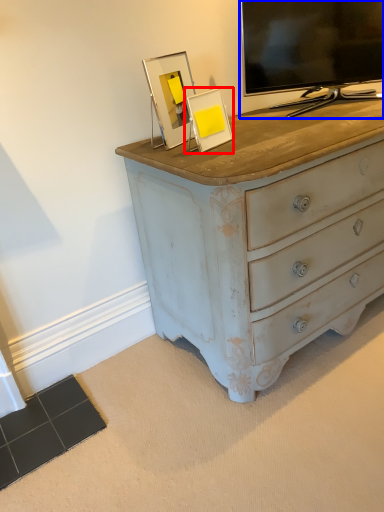
Question: Among these objects, which one is farthest to the camera, picture frame (highlighted by a red box) or television (highlighted by a blue box)?

Choices:
 (A) picture frame
 (B) television

Answer: (B)